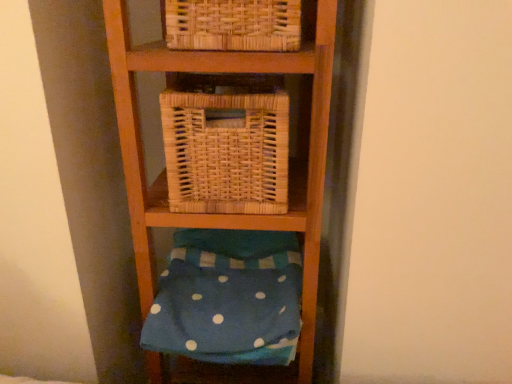
Question: Is woven natural basket at center closer to camera compared to blue polka dot fabric at lower center?

Choices:
 (A) no
 (B) yes

Answer: (B)

Question: Can you confirm if woven natural basket at center is bigger than blue polka dot fabric at lower center?

Choices:
 (A) yes
 (B) no

Answer: (B)

Question: Is woven natural basket at center turned away from blue polka dot fabric at lower center?

Choices:
 (A) no
 (B) yes

Answer: (A)

Question: Could blue polka dot fabric at lower center be considered to be inside woven natural basket at center?

Choices:
 (A) yes
 (B) no

Answer: (B)

Question: From the image's perspective, is woven natural basket at center below blue polka dot fabric at lower center?

Choices:
 (A) no
 (B) yes

Answer: (A)

Question: Can you confirm if woven natural basket at center is wider than blue polka dot fabric at lower center?

Choices:
 (A) yes
 (B) no

Answer: (B)

Question: Is blue polka dot fabric at lower center bigger than woven natural basket at center?

Choices:
 (A) yes
 (B) no

Answer: (A)

Question: Considering the relative positions of blue polka dot fabric at lower center and woven natural basket at center in the image provided, is blue polka dot fabric at lower center to the left of woven natural basket at center from the viewer's perspective?

Choices:
 (A) yes
 (B) no

Answer: (A)

Question: Can you confirm if blue polka dot fabric at lower center is smaller than woven natural basket at center?

Choices:
 (A) no
 (B) yes

Answer: (A)

Question: Can you confirm if blue polka dot fabric at lower center is taller than woven natural basket at center?

Choices:
 (A) no
 (B) yes

Answer: (A)

Question: From a real-world perspective, does blue polka dot fabric at lower center stand above woven natural basket at center?

Choices:
 (A) yes
 (B) no

Answer: (B)

Question: Can you confirm if blue polka dot fabric at lower center is shorter than woven natural basket at center?

Choices:
 (A) yes
 (B) no

Answer: (A)

Question: Is woven natural basket at center in front of or behind blue polka dot fabric at lower center in the image?

Choices:
 (A) behind
 (B) front

Answer: (B)